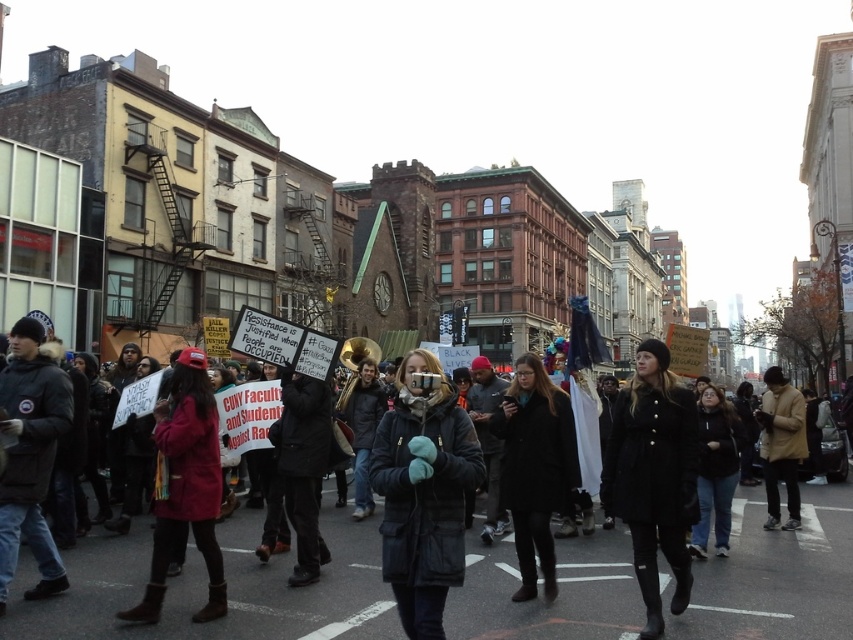
Between red wool coat at lower left and black wool coat at center, which one appears on the right side from the viewer's perspective?

From the viewer's perspective, black wool coat at center appears more on the right side.

Is red wool coat at lower left above black wool coat at center?

Correct, red wool coat at lower left is located above black wool coat at center.

Who is more forward, (167, 560) or (515, 451)?

Point (167, 560)

Find the location of a particular element. The image size is (853, 640). red wool coat at lower left is located at coordinates (184, 486).

Does point (666, 353) come closer to viewer compared to point (788, 497)?

Yes.

Is point (631, 522) farther from camera compared to point (770, 428)?

No, it is not.

Image resolution: width=853 pixels, height=640 pixels. I want to click on black matte coat at center, so click(653, 476).

Where is `black matte coat at center`? black matte coat at center is located at coordinates (653, 476).

Who is higher up, red wool coat at lower left or tan leather jacket at right?

tan leather jacket at right

In order to click on red wool coat at lower left in this screenshot , I will do `click(184, 486)`.

Where is `red wool coat at lower left`? red wool coat at lower left is located at coordinates (184, 486).